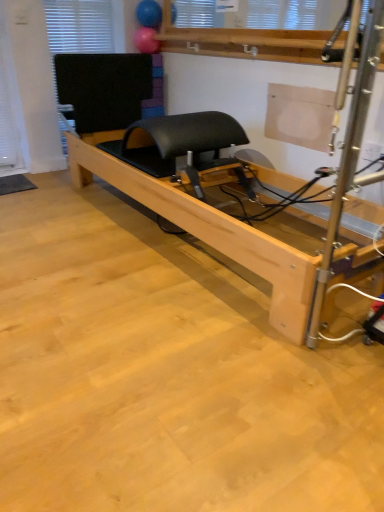
In the scene shown: Measure the distance between black matte window at upper left and camera.

The depth of black matte window at upper left is 3.09 meters.

Describe the element at coordinates (206, 228) in the screenshot. This screenshot has width=384, height=512. I see `natural wood pilates reformer at center` at that location.

The width and height of the screenshot is (384, 512). Find the location of `black matte window at upper left`. black matte window at upper left is located at coordinates (78, 27).

Is natural wood pilates reformer at center looking in the opposite direction of black rubber yoga mat at lower left?

No, natural wood pilates reformer at center's orientation is not away from black rubber yoga mat at lower left.

Which of these two, natural wood pilates reformer at center or black rubber yoga mat at lower left, is wider?

natural wood pilates reformer at center is wider.

Who is more distant, natural wood pilates reformer at center or black rubber yoga mat at lower left?

black rubber yoga mat at lower left is further from the camera.

Is rubber ball at upper center, which is the 2th balloon from top to bottom, facing towards black rubber yoga mat at lower left?

No, rubber ball at upper center, which is the 2th balloon from top to bottom, is not oriented towards black rubber yoga mat at lower left.

Does rubber ball at upper center, which is the 2th balloon from top to bottom, contain black rubber yoga mat at lower left?

No, black rubber yoga mat at lower left is not inside rubber ball at upper center, which is the 2th balloon from top to bottom.

Considering the sizes of rubber ball at upper center, positioned as the first balloon in bottom-to-top order, and black rubber yoga mat at lower left in the image, is rubber ball at upper center, positioned as the first balloon in bottom-to-top order, taller or shorter than black rubber yoga mat at lower left?

Considering their sizes, rubber ball at upper center, positioned as the first balloon in bottom-to-top order, has more height than black rubber yoga mat at lower left.

Considering the relative sizes of rubber ball at upper center, which is the 2th balloon from top to bottom, and black rubber yoga mat at lower left in the image provided, is rubber ball at upper center, which is the 2th balloon from top to bottom, smaller than black rubber yoga mat at lower left?

No, rubber ball at upper center, which is the 2th balloon from top to bottom, is not smaller than black rubber yoga mat at lower left.

How far apart are black matte window at upper left and rubberized blue ball at upper center, positioned as the second balloon in bottom-to-top order?

A distance of 17.53 inches exists between black matte window at upper left and rubberized blue ball at upper center, positioned as the second balloon in bottom-to-top order.

At what (x,y) coordinates should I click in order to perform the action: click on window on the left of rubberized blue ball at upper center, positioned as the second balloon in bottom-to-top order. Please return your answer as a coordinate pair (x, y). The width and height of the screenshot is (384, 512). Looking at the image, I should click on (78, 27).

Is black matte window at upper left outside of rubberized blue ball at upper center, positioned as the second balloon in bottom-to-top order?

Indeed, black matte window at upper left is completely outside rubberized blue ball at upper center, positioned as the second balloon in bottom-to-top order.

From a real-world perspective, is black matte window at upper left physically located above or below rubberized blue ball at upper center, positioned as the second balloon in bottom-to-top order?

In terms of real-world spatial position, black matte window at upper left is below rubberized blue ball at upper center, positioned as the second balloon in bottom-to-top order.

Which is more distant, [138,7] or [157,46]?

The point [157,46] is farther from the camera.

Considering the sizes of objects rubberized blue ball at upper center, the 1th balloon from the top, and rubber ball at upper center, which is the 2th balloon from top to bottom, in the image provided, who is shorter, rubberized blue ball at upper center, the 1th balloon from the top, or rubber ball at upper center, which is the 2th balloon from top to bottom,?

Standing shorter between the two is rubber ball at upper center, which is the 2th balloon from top to bottom.

From a real-world perspective, is rubberized blue ball at upper center, positioned as the second balloon in bottom-to-top order, below rubber ball at upper center, which is the 2th balloon from top to bottom?

No, from a real-world perspective, rubberized blue ball at upper center, positioned as the second balloon in bottom-to-top order, is not under rubber ball at upper center, which is the 2th balloon from top to bottom.

From the image's perspective, would you say rubberized blue ball at upper center, the 1th balloon from the top, is shown under rubber ball at upper center, which is the 2th balloon from top to bottom?

Actually, rubberized blue ball at upper center, the 1th balloon from the top, appears above rubber ball at upper center, which is the 2th balloon from top to bottom, in the image.

Does black matte window at upper left turn towards natural wood pilates reformer at center?

Yes.

Which object is thinner, black matte window at upper left or natural wood pilates reformer at center?

black matte window at upper left.

At what (x,y) coordinates should I click in order to perform the action: click on window on the left of natural wood pilates reformer at center. Please return your answer as a coordinate pair (x, y). This screenshot has width=384, height=512. Looking at the image, I should click on (78, 27).

How many degrees apart are the facing directions of black matte window at upper left and natural wood pilates reformer at center?

The angle between the facing direction of black matte window at upper left and the facing direction of natural wood pilates reformer at center is 91.3 degrees.

What's the angular difference between black matte window at upper left and black rubber yoga mat at lower left's facing directions?

black matte window at upper left and black rubber yoga mat at lower left are facing 2.76 degrees away from each other.

Is point (43, 1) closer or farther from the camera than point (33, 188)?

Point (43, 1) appears to be closer to the viewer than point (33, 188).

Is black matte window at upper left further to camera compared to black rubber yoga mat at lower left?

Yes.

Visually, is black matte window at upper left positioned to the left or to the right of black rubber yoga mat at lower left?

black matte window at upper left is to the right of black rubber yoga mat at lower left.

Does black rubber yoga mat at lower left have a greater height compared to natural wood pilates reformer at center?

Incorrect, the height of black rubber yoga mat at lower left is not larger of that of natural wood pilates reformer at center.

From a real-world perspective, who is located lower, black rubber yoga mat at lower left or natural wood pilates reformer at center?

black rubber yoga mat at lower left.

From the image's perspective, between black rubber yoga mat at lower left and natural wood pilates reformer at center, which one is located above?

natural wood pilates reformer at center is shown above in the image.

Is black rubber yoga mat at lower left turned away from natural wood pilates reformer at center?

No.

In order to click on yoga mat below the natural wood pilates reformer at center (from a real-world perspective) in this screenshot , I will do `click(15, 184)`.

From the image's perspective, starting from the black rubber yoga mat at lower left, which balloon is the 1st one above? Please provide its 2D coordinates.

[(146, 40)]

Considering their positions, is black matte window at upper left positioned closer to black rubber yoga mat at lower left than rubberized blue ball at upper center, positioned as the second balloon in bottom-to-top order?

Based on the image, black matte window at upper left appears to be nearer to black rubber yoga mat at lower left.

From the image, which object appears to be farther from black matte window at upper left, rubber ball at upper center, which is the 2th balloon from top to bottom, or rubberized blue ball at upper center, positioned as the second balloon in bottom-to-top order?

rubberized blue ball at upper center, positioned as the second balloon in bottom-to-top order, lies further to black matte window at upper left than the other object.

Estimate the real-world distances between objects in this image. Which object is closer to black matte window at upper left, black rubber yoga mat at lower left or natural wood pilates reformer at center?

natural wood pilates reformer at center.

Which object lies further to the anchor point rubber ball at upper center, positioned as the first balloon in bottom-to-top order, black rubber yoga mat at lower left or black matte window at upper left?

Among the two, black rubber yoga mat at lower left is located further to rubber ball at upper center, positioned as the first balloon in bottom-to-top order.

Considering their positions, is natural wood pilates reformer at center positioned further to black matte window at upper left than rubber ball at upper center, positioned as the first balloon in bottom-to-top order?

natural wood pilates reformer at center lies further to black matte window at upper left than the other object.

Based on their spatial positions, is rubberized blue ball at upper center, the 1th balloon from the top, or rubber ball at upper center, positioned as the first balloon in bottom-to-top order, further from natural wood pilates reformer at center?

rubberized blue ball at upper center, the 1th balloon from the top.

From the image, which object appears to be farther from rubber ball at upper center, which is the 2th balloon from top to bottom, rubberized blue ball at upper center, the 1th balloon from the top, or black rubber yoga mat at lower left?

The object further to rubber ball at upper center, which is the 2th balloon from top to bottom, is black rubber yoga mat at lower left.

Based on their spatial positions, is rubberized blue ball at upper center, the 1th balloon from the top, or rubber ball at upper center, positioned as the first balloon in bottom-to-top order, closer to black matte window at upper left?

Based on the image, rubber ball at upper center, positioned as the first balloon in bottom-to-top order, appears to be nearer to black matte window at upper left.

Identify the location of yoga mat located between natural wood pilates reformer at center and black matte window at upper left in the depth direction. (15, 184).

Identify the location of window between natural wood pilates reformer at center and rubber ball at upper center, positioned as the first balloon in bottom-to-top order, in the front-back direction. Image resolution: width=384 pixels, height=512 pixels. (78, 27).

Identify the location of window positioned between natural wood pilates reformer at center and rubberized blue ball at upper center, the 1th balloon from the top, from near to far. [78, 27].

Where is `yoga mat between natural wood pilates reformer at center and rubber ball at upper center, positioned as the first balloon in bottom-to-top order, in the front-back direction`? The image size is (384, 512). yoga mat between natural wood pilates reformer at center and rubber ball at upper center, positioned as the first balloon in bottom-to-top order, in the front-back direction is located at coordinates (15, 184).